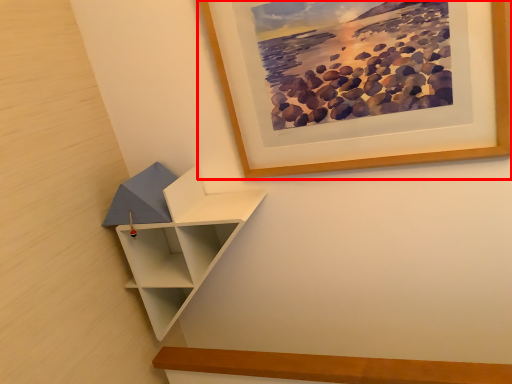
Question: From the image's perspective, where is picture frame (annotated by the red box) located relative to shelf?

Choices:
 (A) above
 (B) below

Answer: (A)